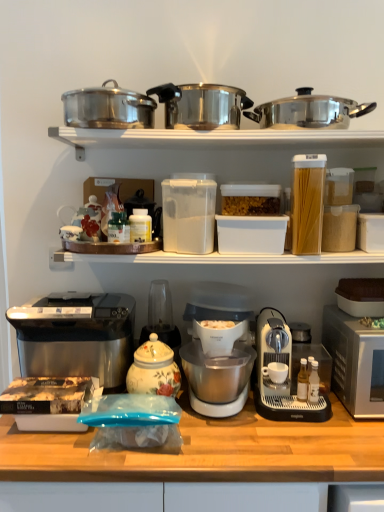
Where is `free space to the right of porcelain floral jar at center, acting as the 4th kitchen appliance starting from the top`? free space to the right of porcelain floral jar at center, acting as the 4th kitchen appliance starting from the top is located at coordinates (209, 422).